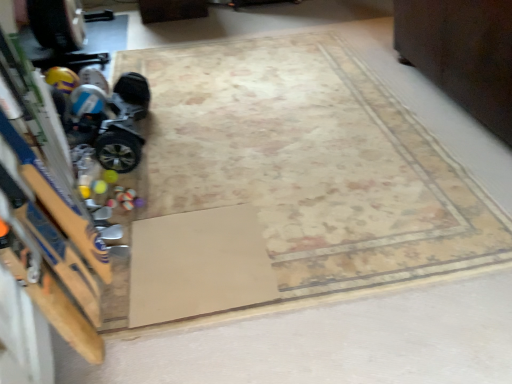
The height and width of the screenshot is (384, 512). I want to click on free space in front of shiny metallic hoverboard at left, so click(x=153, y=182).